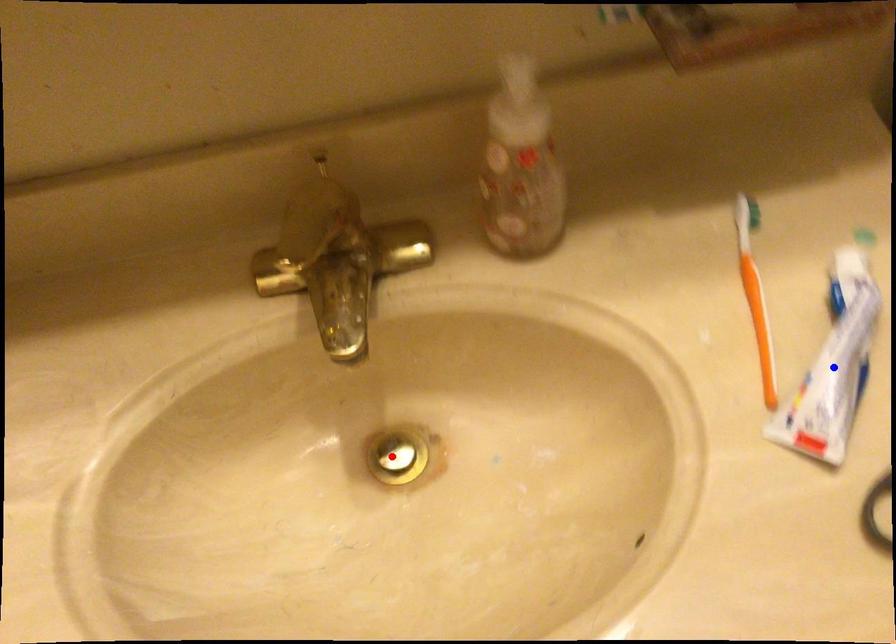
Question: Two points are marked on the image. Which point is closer to the camera?

Choices:
 (A) Blue point is closer.
 (B) Red point is closer.

Answer: (A)